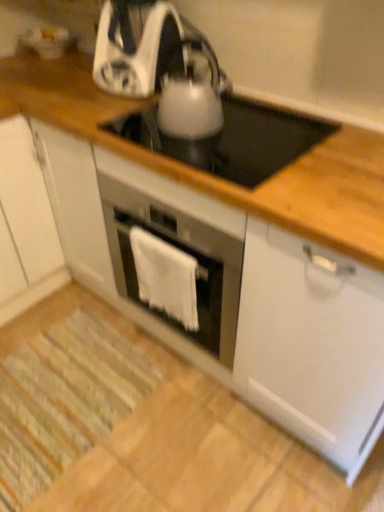
Describe the element at coordinates (165, 277) in the screenshot. I see `white fabric towel at center` at that location.

Locate an element on the screen. white fabric towel at center is located at coordinates (165, 277).

Where is `satin silver kettle at center, which appears as the 2th kitchen appliance when viewed from the back`? The height and width of the screenshot is (512, 384). satin silver kettle at center, which appears as the 2th kitchen appliance when viewed from the back is located at coordinates (192, 98).

What is the approximate width of satin silver kettle at center, which appears as the 2th kitchen appliance when viewed from the back?

It is 8.78 inches.

You are a GUI agent. You are given a task and a screenshot of the screen. Output one action in this format:
    pyautogui.click(x=<x>, y=<y>)
    Task: Click on the white glossy kettle at upper center, acting as the first kitchen appliance starting from the back
    Image resolution: width=384 pixels, height=512 pixels.
    Given the screenshot: What is the action you would take?
    pyautogui.click(x=132, y=46)

Describe the element at coordinates (25, 225) in the screenshot. This screenshot has width=384, height=512. I see `white matte cabinet at left` at that location.

At what (x,y) coordinates should I click in order to perform the action: click on white glossy electric kettle at center. Please return your answer as a coordinate pair (x, y). Looking at the image, I should click on (232, 140).

Is point (150, 75) less distant than point (266, 127)?

Yes, point (150, 75) is closer to viewer.

Which object is positioned more to the left, white glossy kettle at upper center, arranged as the 2th kitchen appliance when viewed from the front, or white glossy electric kettle at center?

white glossy kettle at upper center, arranged as the 2th kitchen appliance when viewed from the front.

Do you think white glossy kettle at upper center, arranged as the 2th kitchen appliance when viewed from the front, is within white glossy electric kettle at center, or outside of it?

white glossy kettle at upper center, arranged as the 2th kitchen appliance when viewed from the front, is outside white glossy electric kettle at center.

Considering the points (292, 129) and (182, 324), which point is in front, point (292, 129) or point (182, 324)?

Positioned in front is point (182, 324).

Does white glossy electric kettle at center touch white fabric towel at center?

No, white glossy electric kettle at center is not next to white fabric towel at center.

From a real-world perspective, does white glossy electric kettle at center stand above white fabric towel at center?

Indeed, from a real-world perspective, white glossy electric kettle at center stands above white fabric towel at center.

How far apart are white glossy electric kettle at center and white fabric towel at center?

white glossy electric kettle at center and white fabric towel at center are 22.37 inches apart from each other.

In the scene shown: Which object is positioned more to the left, white glossy electric kettle at center or white matte cabinet at left?

white matte cabinet at left.

From a real-world perspective, who is located lower, white glossy electric kettle at center or white matte cabinet at left?

white matte cabinet at left.

Which of these two, white glossy electric kettle at center or white matte cabinet at left, is smaller?

With smaller size is white glossy electric kettle at center.

The image size is (384, 512). Find the location of `cabinetry beneath the white glossy electric kettle at center (from a real-world perspective)`. cabinetry beneath the white glossy electric kettle at center (from a real-world perspective) is located at coordinates (25, 225).

Is white glossy kettle at upper center, acting as the first kitchen appliance starting from the back, facing away from white matte cabinet at left?

No, white glossy kettle at upper center, acting as the first kitchen appliance starting from the back, is not facing the opposite direction of white matte cabinet at left.

Between white glossy kettle at upper center, arranged as the 2th kitchen appliance when viewed from the front, and white matte cabinet at left, which one appears on the left side from the viewer's perspective?

Positioned to the left is white matte cabinet at left.

Is white glossy kettle at upper center, acting as the first kitchen appliance starting from the back, located outside white matte cabinet at left?

Yes, white glossy kettle at upper center, acting as the first kitchen appliance starting from the back, is located beyond the bounds of white matte cabinet at left.

Is white glossy kettle at upper center, acting as the first kitchen appliance starting from the back, taller or shorter than white matte cabinet at left?

Considering their sizes, white glossy kettle at upper center, acting as the first kitchen appliance starting from the back, has less height than white matte cabinet at left.

In terms of width, does satin silver kettle at center, arranged as the 1th kitchen appliance when viewed from the front, look wider or thinner when compared to white fabric towel at center?

Considering their sizes, satin silver kettle at center, arranged as the 1th kitchen appliance when viewed from the front, looks broader than white fabric towel at center.

From the image's perspective, is satin silver kettle at center, arranged as the 1th kitchen appliance when viewed from the front, positioned above or below white fabric towel at center?

Based on their image positions, satin silver kettle at center, arranged as the 1th kitchen appliance when viewed from the front, is located above white fabric towel at center.

Is satin silver kettle at center, arranged as the 1th kitchen appliance when viewed from the front, at the left side of white fabric towel at center?

No, satin silver kettle at center, arranged as the 1th kitchen appliance when viewed from the front, is not to the left of white fabric towel at center.

Is satin silver kettle at center, arranged as the 1th kitchen appliance when viewed from the front, smaller than white fabric towel at center?

Actually, satin silver kettle at center, arranged as the 1th kitchen appliance when viewed from the front, might be larger than white fabric towel at center.

Can you tell me how much white glossy electric kettle at center and satin silver kettle at center, arranged as the 1th kitchen appliance when viewed from the front, differ in facing direction?

The angular difference between white glossy electric kettle at center and satin silver kettle at center, arranged as the 1th kitchen appliance when viewed from the front, is 0.000487 degrees.

Which object is wider, white glossy electric kettle at center or satin silver kettle at center, which appears as the 2th kitchen appliance when viewed from the back?

With larger width is white glossy electric kettle at center.

Considering the relative sizes of white glossy electric kettle at center and satin silver kettle at center, arranged as the 1th kitchen appliance when viewed from the front, in the image provided, is white glossy electric kettle at center shorter than satin silver kettle at center, arranged as the 1th kitchen appliance when viewed from the front,?

Correct, white glossy electric kettle at center is not as tall as satin silver kettle at center, arranged as the 1th kitchen appliance when viewed from the front.

Considering the sizes of objects white glossy electric kettle at center and satin silver kettle at center, arranged as the 1th kitchen appliance when viewed from the front, in the image provided, who is bigger, white glossy electric kettle at center or satin silver kettle at center, arranged as the 1th kitchen appliance when viewed from the front,?

Bigger between the two is white glossy electric kettle at center.

Is white matte cabinet at left located within white fabric towel at center?

Actually, white matte cabinet at left is outside white fabric towel at center.

Is white fabric towel at center next to white matte cabinet at left?

white fabric towel at center and white matte cabinet at left are clearly separated.

What's the angular difference between white fabric towel at center and white matte cabinet at left's facing directions?

88.7 degrees.

Which object is positioned more to the left, white fabric towel at center or white matte cabinet at left?

Positioned to the left is white matte cabinet at left.

You are a GUI agent. You are given a task and a screenshot of the screen. Output one action in this format:
    pyautogui.click(x=<x>, y=<y>)
    Task: Click on the gas stove on the right of white glossy kettle at upper center, acting as the first kitchen appliance starting from the back
    This screenshot has height=512, width=384.
    Given the screenshot: What is the action you would take?
    pyautogui.click(x=232, y=140)

Identify the location of gas stove above the white fabric towel at center (from the image's perspective). (232, 140).

Which object lies nearer to the anchor point white glossy electric kettle at center, white matte cabinet at left or satin silver kettle at center, which appears as the 2th kitchen appliance when viewed from the back?

The object closer to white glossy electric kettle at center is satin silver kettle at center, which appears as the 2th kitchen appliance when viewed from the back.

Looking at this image, looking at the image, which one is located further to white fabric towel at center, white glossy electric kettle at center or white glossy kettle at upper center, acting as the first kitchen appliance starting from the back?

Among the two, white glossy kettle at upper center, acting as the first kitchen appliance starting from the back, is located further to white fabric towel at center.

Based on their spatial positions, is white glossy kettle at upper center, acting as the first kitchen appliance starting from the back, or white matte cabinet at left closer to white fabric towel at center?

The object closer to white fabric towel at center is white glossy kettle at upper center, acting as the first kitchen appliance starting from the back.

When comparing their distances from white fabric towel at center, does white glossy electric kettle at center or satin silver kettle at center, arranged as the 1th kitchen appliance when viewed from the front, seem further?

Based on the image, white glossy electric kettle at center appears to be further to white fabric towel at center.

Estimate the real-world distances between objects in this image. Which object is further from white fabric towel at center, white matte cabinet at left or white glossy electric kettle at center?

The object further to white fabric towel at center is white matte cabinet at left.

Estimate the real-world distances between objects in this image. Which object is further from white glossy kettle at upper center, arranged as the 2th kitchen appliance when viewed from the front, white fabric towel at center or satin silver kettle at center, arranged as the 1th kitchen appliance when viewed from the front?

Among the two, white fabric towel at center is located further to white glossy kettle at upper center, arranged as the 2th kitchen appliance when viewed from the front.

Estimate the real-world distances between objects in this image. Which object is closer to satin silver kettle at center, arranged as the 1th kitchen appliance when viewed from the front, white glossy kettle at upper center, arranged as the 2th kitchen appliance when viewed from the front, or white matte cabinet at left?

white glossy kettle at upper center, arranged as the 2th kitchen appliance when viewed from the front, is positioned closer to the anchor satin silver kettle at center, arranged as the 1th kitchen appliance when viewed from the front.

When comparing their distances from white glossy kettle at upper center, arranged as the 2th kitchen appliance when viewed from the front, does white glossy electric kettle at center or white matte cabinet at left seem closer?

The object closer to white glossy kettle at upper center, arranged as the 2th kitchen appliance when viewed from the front, is white glossy electric kettle at center.

Find the location of a particular element. The height and width of the screenshot is (512, 384). gas stove between satin silver kettle at center, which appears as the 2th kitchen appliance when viewed from the back, and white fabric towel at center in the up-down direction is located at coordinates (232, 140).

Where is `kitchen appliance between white matte cabinet at left and white fabric towel at center`? kitchen appliance between white matte cabinet at left and white fabric towel at center is located at coordinates (132, 46).

I want to click on cloth between white matte cabinet at left and white glossy electric kettle at center from left to right, so click(165, 277).

At what (x,y) coordinates should I click in order to perform the action: click on kitchen appliance between white glossy kettle at upper center, arranged as the 2th kitchen appliance when viewed from the front, and white glossy electric kettle at center vertically. Please return your answer as a coordinate pair (x, y). The width and height of the screenshot is (384, 512). Looking at the image, I should click on (192, 98).